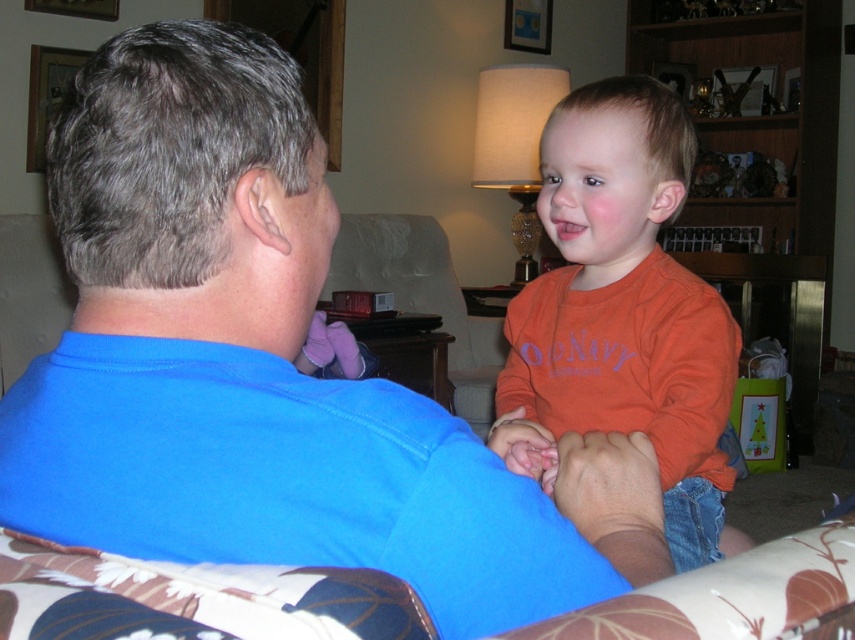
Question: Does blue cotton shirt at center appear on the right side of orange cotton shirt at center?

Choices:
 (A) no
 (B) yes

Answer: (A)

Question: Which point is farther from the camera taking this photo?

Choices:
 (A) (505, 316)
 (B) (610, 557)

Answer: (A)

Question: Which of the following is the farthest from the observer?

Choices:
 (A) (640, 200)
 (B) (257, 152)

Answer: (A)

Question: Observing the image, what is the correct spatial positioning of blue cotton shirt at center in reference to orange cotton shirt at center?

Choices:
 (A) above
 (B) below

Answer: (B)

Question: Observing the image, what is the correct spatial positioning of blue cotton shirt at center in reference to orange cotton shirt at center?

Choices:
 (A) below
 (B) above

Answer: (A)